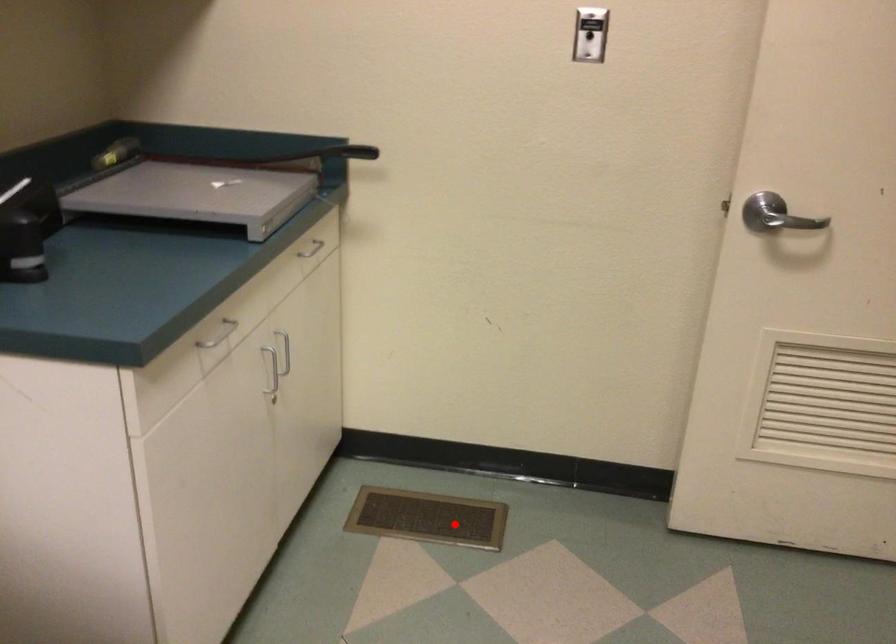
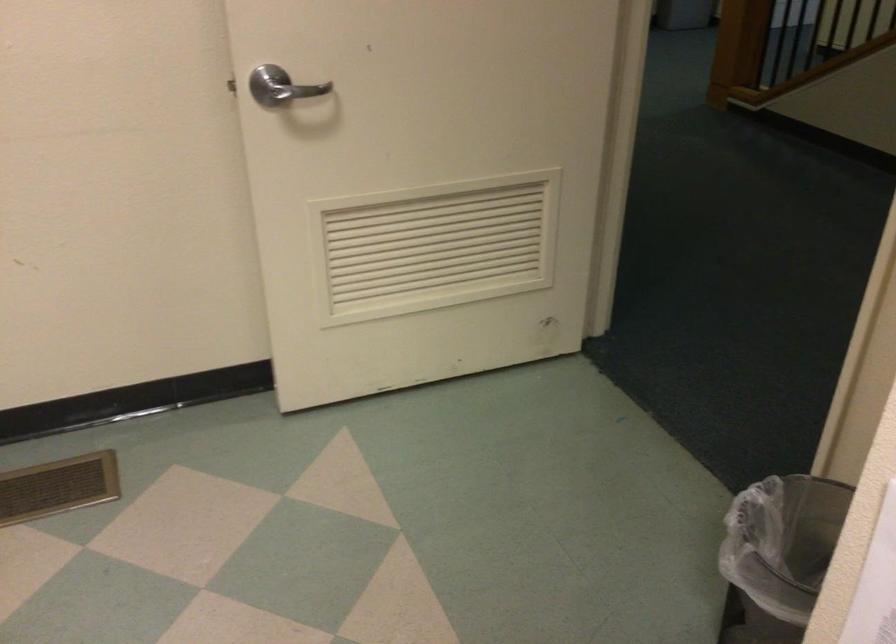
Question: I am providing you with two images of the same scene from different viewpoints. Image1 has a red point marked. In image2, the corresponding 3D location appears at what relative position? Reply with the corresponding letter.

Choices:
 (A) Closer
 (B) Farther

Answer: (A)